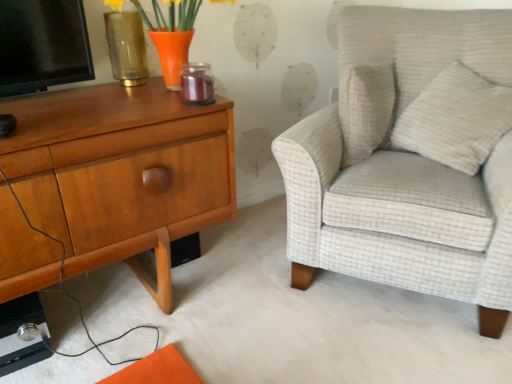
Based on the photo, in order to face light beige textured armchair at right, should I rotate leftwards or rightwards?

It's best to rotate right around 20.741 degrees.

Where is `woodennightstand at left`? woodennightstand at left is located at coordinates (121, 173).

Considering the positions of points (448, 86) and (133, 72), is point (448, 86) farther from camera compared to point (133, 72)?

Yes, point (448, 86) is farther from viewer.

How different are the orientations of white textured pillow at upper right and matte gold vase at upper left in degrees?

The angular difference between white textured pillow at upper right and matte gold vase at upper left is 91.3 degrees.

The image size is (512, 384). I want to click on vase positioned vertically above the white textured pillow at upper right (from a real-world perspective), so click(x=126, y=47).

Measure the distance from white textured pillow at upper right to matte gold vase at upper left.

1.09 meters.

Who is taller, light beige textured armchair at right or white textured pillow at upper right?

With more height is light beige textured armchair at right.

Is light beige textured armchair at right wider than white textured pillow at upper right?

Yes.

Is light beige textured armchair at right looking in the opposite direction of white textured pillow at upper right?

That's right, light beige textured armchair at right is facing away from white textured pillow at upper right.

From the image's perspective, which object appears higher, light beige textured armchair at right or white textured pillow at upper right?

white textured pillow at upper right.

Is white textured pillow at upper right bigger than light beige textured armchair at right?

Incorrect, white textured pillow at upper right is not larger than light beige textured armchair at right.

Considering the sizes of objects white textured pillow at upper right and light beige textured armchair at right in the image provided, who is taller, white textured pillow at upper right or light beige textured armchair at right?

light beige textured armchair at right is taller.

Is white textured pillow at upper right in contact with light beige textured armchair at right?

white textured pillow at upper right and light beige textured armchair at right are clearly separated.

Is orange glass vase at upper left smaller than matte gold vase at upper left?

Actually, orange glass vase at upper left might be larger than matte gold vase at upper left.

Is orange glass vase at upper left oriented away from matte gold vase at upper left?

That's right, orange glass vase at upper left is facing away from matte gold vase at upper left.

What's the angular difference between orange glass vase at upper left and matte gold vase at upper left's facing directions?

The facing directions of orange glass vase at upper left and matte gold vase at upper left are 171 degrees apart.

Is orange glass vase at upper left further to camera compared to matte gold vase at upper left?

No, the depth of orange glass vase at upper left is less than that of matte gold vase at upper left.

Based on the photo, from a real-world perspective, is matte gold vase at upper left above or below woodennightstand at left?

From a real-world perspective, matte gold vase at upper left is physically above woodennightstand at left.

Considering the relative sizes of matte gold vase at upper left and woodennightstand at left in the image provided, is matte gold vase at upper left shorter than woodennightstand at left?

Correct, matte gold vase at upper left is not as tall as woodennightstand at left.

Visually, is matte gold vase at upper left positioned to the left or to the right of woodennightstand at left?

Based on their positions, matte gold vase at upper left is located to the right of woodennightstand at left.

How far apart are matte gold vase at upper left and woodennightstand at left?

They are 14.38 inches apart.

The height and width of the screenshot is (384, 512). Find the location of `floral arrangement lying on the right of matte gold vase at upper left`. floral arrangement lying on the right of matte gold vase at upper left is located at coordinates (172, 35).

Is matte gold vase at upper left directly adjacent to orange glass vase at upper left?

No, matte gold vase at upper left is not making contact with orange glass vase at upper left.

Measure the distance from matte gold vase at upper left to orange glass vase at upper left.

matte gold vase at upper left and orange glass vase at upper left are 17.54 centimeters apart.

Considering the positions of points (118, 40) and (163, 42), is point (118, 40) farther from camera compared to point (163, 42)?

Yes.

From the image's perspective, is orange glass vase at upper left above white textured pillow at upper right?

Yes.

Does orange glass vase at upper left turn towards white textured pillow at upper right?

No, orange glass vase at upper left does not turn towards white textured pillow at upper right.

Considering the positions of objects orange glass vase at upper left and white textured pillow at upper right in the image provided, who is more to the right, orange glass vase at upper left or white textured pillow at upper right?

Positioned to the right is white textured pillow at upper right.

Are orange glass vase at upper left and white textured pillow at upper right far apart?

That's not correct — orange glass vase at upper left is a little close to white textured pillow at upper right.

At what (x,y) coordinates should I click in order to perform the action: click on vase above the white textured pillow at upper right (from a real-world perspective). Please return your answer as a coordinate pair (x, y). Looking at the image, I should click on (126, 47).

Where is `chair located on the left of white textured pillow at upper right`? This screenshot has height=384, width=512. chair located on the left of white textured pillow at upper right is located at coordinates (402, 167).

Considering their positions, is white textured pillow at upper right positioned further to orange glass vase at upper left than light beige textured armchair at right?

white textured pillow at upper right lies further to orange glass vase at upper left than the other object.

Considering their positions, is matte gold vase at upper left positioned further to woodennightstand at left than orange glass vase at upper left?

Among the two, matte gold vase at upper left is located further to woodennightstand at left.

Looking at the image, which one is located further to woodennightstand at left, matte gold vase at upper left or light beige textured armchair at right?

Based on the image, light beige textured armchair at right appears to be further to woodennightstand at left.

From the image, which object appears to be farther from matte gold vase at upper left, woodennightstand at left or white textured pillow at upper right?

white textured pillow at upper right.

When comparing their distances from matte gold vase at upper left, does orange glass vase at upper left or woodennightstand at left seem closer?

orange glass vase at upper left.

Looking at the image, which one is located closer to light beige textured armchair at right, white textured pillow at upper right or woodennightstand at left?

Among the two, white textured pillow at upper right is located nearer to light beige textured armchair at right.

Estimate the real-world distances between objects in this image. Which object is closer to light beige textured armchair at right, white textured pillow at upper right or matte gold vase at upper left?

The object closer to light beige textured armchair at right is white textured pillow at upper right.

Based on their spatial positions, is matte gold vase at upper left or orange glass vase at upper left closer to white textured pillow at upper right?

The object closer to white textured pillow at upper right is orange glass vase at upper left.

The image size is (512, 384). I want to click on vase between woodennightstand at left and white textured pillow at upper right in the horizontal direction, so click(126, 47).

This screenshot has width=512, height=384. I want to click on floral arrangement between woodennightstand at left and white textured pillow at upper right from left to right, so click(172, 35).

This screenshot has height=384, width=512. I want to click on chair situated between matte gold vase at upper left and white textured pillow at upper right from left to right, so click(x=402, y=167).

Find the location of a particular element. The height and width of the screenshot is (384, 512). floral arrangement situated between matte gold vase at upper left and white textured pillow at upper right from left to right is located at coordinates (172, 35).